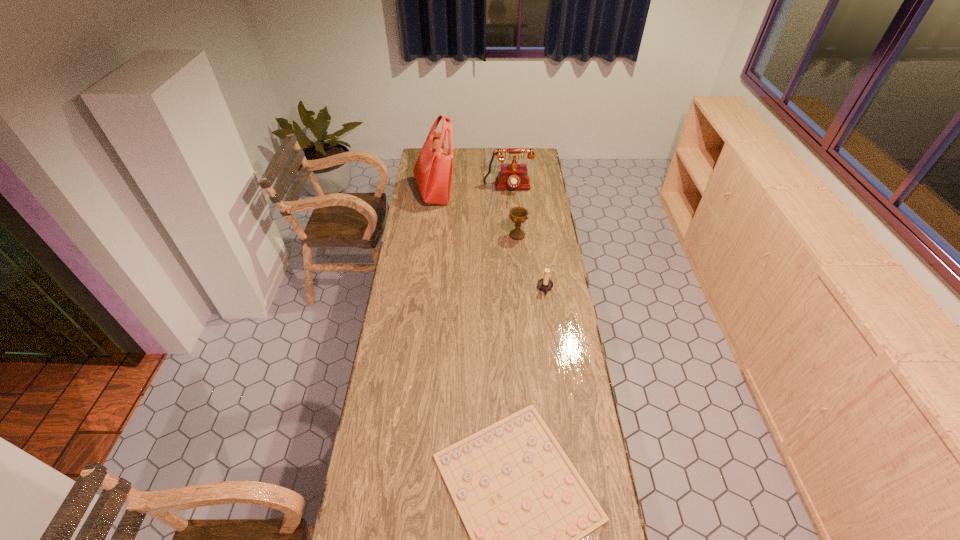
Identify the location of free area in between the second nearest object and the third nearest object. (531, 262).

At what (x,y) coordinates should I click in order to perform the action: click on free space between the tallest object and the fourth farthest object. Please return your answer as a coordinate pair (x, y). The height and width of the screenshot is (540, 960). Looking at the image, I should click on (490, 240).

Where is `free space between the candle holder and the second tallest object`? free space between the candle holder and the second tallest object is located at coordinates (526, 239).

The width and height of the screenshot is (960, 540). In order to click on vacant area between the second nearest object and the fourth shortest object in this screenshot , I will do `click(526, 239)`.

Locate an element on the screen. This screenshot has height=540, width=960. vacant region between the second tallest object and the fourth tallest object is located at coordinates (526, 239).

Choose which object is the nearest neighbor to the third shortest object. Please provide its 2D coordinates. Your answer should be formatted as a tuple, i.e. [(x, y)], where the tuple contains the x and y coordinates of a point satisfying the conditions above.

[(545, 284)]

Identify which object is the third nearest to the nearest object. Please provide its 2D coordinates. Your answer should be formatted as a tuple, i.e. [(x, y)], where the tuple contains the x and y coordinates of a point satisfying the conditions above.

[(433, 171)]

You are a GUI agent. You are given a task and a screenshot of the screen. Output one action in this format:
    pyautogui.click(x=<x>, y=<y>)
    Task: Click on the free spot that satisfies the following two spatial constraints: 1. on the dial of the fourth shortest object; 2. on the front-facing side of the handbag
    The image size is (960, 540).
    Given the screenshot: What is the action you would take?
    pyautogui.click(x=508, y=192)

Where is `vacant space that satisfies the following two spatial constraints: 1. on the dial of the telephone; 2. on the front-facing side of the handbag`? This screenshot has width=960, height=540. vacant space that satisfies the following two spatial constraints: 1. on the dial of the telephone; 2. on the front-facing side of the handbag is located at coordinates (508, 192).

This screenshot has height=540, width=960. I want to click on vacant space that satisfies the following two spatial constraints: 1. on the back side of the third farthest object; 2. on the front-facing side of the tallest object, so click(x=514, y=192).